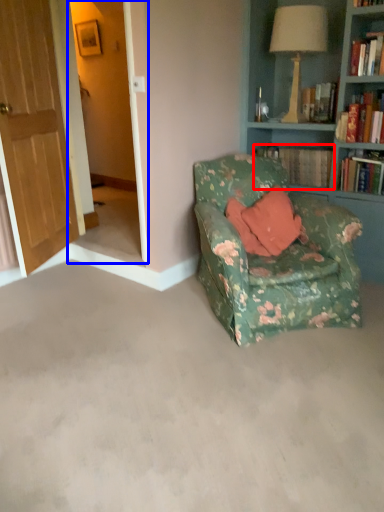
Question: Which point is closer to the camera, book (highlighted by a red box) or screen door (highlighted by a blue box)?

Choices:
 (A) book
 (B) screen door

Answer: (B)